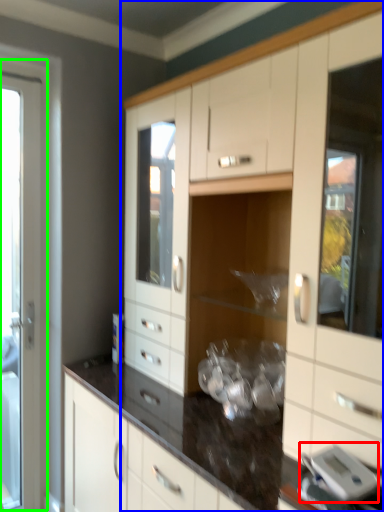
Question: Considering the real-world distances, which object is farthest from appliance (highlighted by a red box)? cabinetry (highlighted by a blue box) or screen door (highlighted by a green box)?

Choices:
 (A) cabinetry
 (B) screen door

Answer: (B)